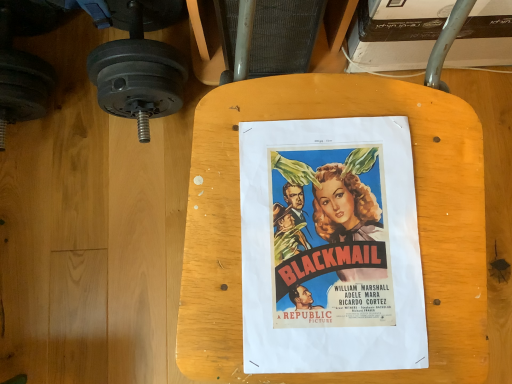
Question: Is there a large distance between matte paper poster at center and matte black dumbbell at left?

Choices:
 (A) no
 (B) yes

Answer: (A)

Question: Could you tell me if matte paper poster at center is facing matte black dumbbell at left?

Choices:
 (A) no
 (B) yes

Answer: (A)

Question: Is matte paper poster at center in front of matte black dumbbell at left?

Choices:
 (A) yes
 (B) no

Answer: (A)

Question: Considering the relative sizes of matte paper poster at center and matte black dumbbell at left in the image provided, is matte paper poster at center smaller than matte black dumbbell at left?

Choices:
 (A) yes
 (B) no

Answer: (A)

Question: Is matte paper poster at center with matte black dumbbell at left?

Choices:
 (A) yes
 (B) no

Answer: (B)

Question: From the image's perspective, relative to wooden table at center, is matte black dumbbell at left above or below?

Choices:
 (A) below
 (B) above

Answer: (B)

Question: Relative to wooden table at center, is matte black dumbbell at left in front or behind?

Choices:
 (A) front
 (B) behind

Answer: (B)

Question: From a real-world perspective, is matte black dumbbell at left above or below wooden table at center?

Choices:
 (A) below
 (B) above

Answer: (A)

Question: Visually, is matte black dumbbell at left positioned to the left or to the right of wooden table at center?

Choices:
 (A) left
 (B) right

Answer: (A)

Question: Visually, is wooden table at center positioned to the left or to the right of matte paper poster at center?

Choices:
 (A) left
 (B) right

Answer: (B)

Question: Is point [219, 235] positioned closer to the camera than point [329, 332]?

Choices:
 (A) farther
 (B) closer

Answer: (A)

Question: Is wooden table at center bigger or smaller than matte paper poster at center?

Choices:
 (A) big
 (B) small

Answer: (A)

Question: From a real-world perspective, relative to matte paper poster at center, is wooden table at center vertically above or below?

Choices:
 (A) above
 (B) below

Answer: (B)

Question: Considering the positions of matte paper poster at center and matte black dumbbell at left in the image, is matte paper poster at center bigger or smaller than matte black dumbbell at left?

Choices:
 (A) big
 (B) small

Answer: (B)

Question: Considering the positions of matte paper poster at center and matte black dumbbell at left in the image, is matte paper poster at center wider or thinner than matte black dumbbell at left?

Choices:
 (A) thin
 (B) wide

Answer: (A)